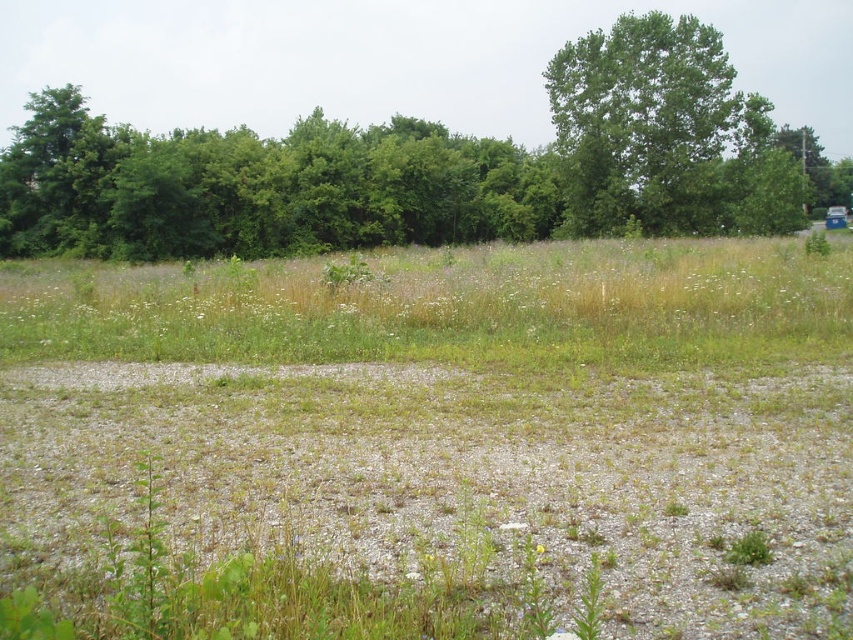
Question: In this image, where is green leafy tree at upper center located relative to green leafy tree at upper right?

Choices:
 (A) left
 (B) right

Answer: (A)

Question: Which object is farther from the camera taking this photo?

Choices:
 (A) green leafy tree at upper right
 (B) green grass at center
 (C) green leafy tree at upper center

Answer: (A)

Question: Which point is farther to the camera?

Choices:
 (A) (427, 308)
 (B) (595, 230)
 (C) (396, 509)
 (D) (535, 545)

Answer: (B)

Question: Where is gray gravel at center located in relation to green grass at center in the image?

Choices:
 (A) right
 (B) left

Answer: (A)

Question: Which of the following is the closest to the observer?

Choices:
 (A) (759, 557)
 (B) (656, 113)
 (C) (582, 93)
 (D) (755, 250)

Answer: (A)

Question: Is gray gravel at center bigger than green grass at center?

Choices:
 (A) no
 (B) yes

Answer: (A)